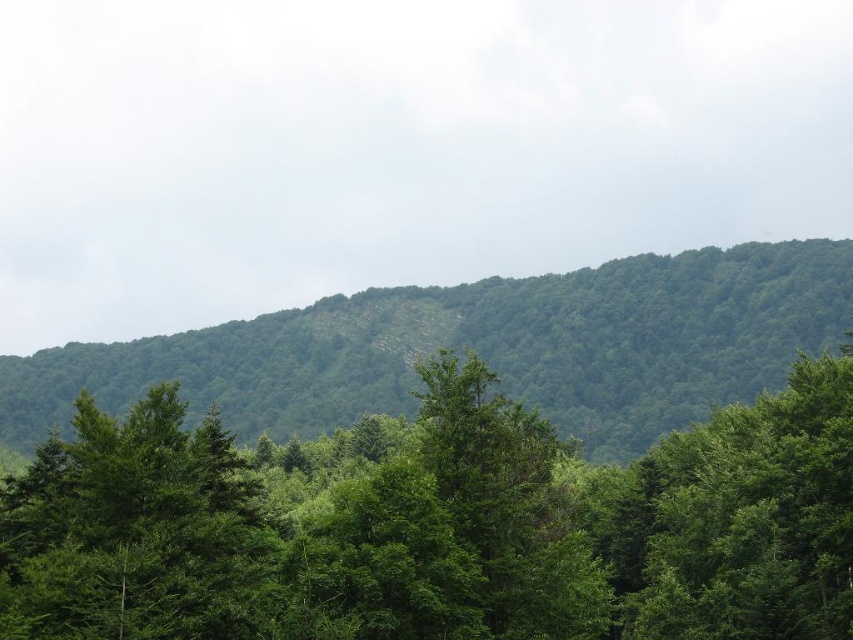
Between green leafy tree at center and green leafy forest at upper center, which one is positioned higher?

green leafy forest at upper center

Does point (474, 493) come behind point (572, 356)?

No, (474, 493) is in front of (572, 356).

Which is behind, point (386, 588) or point (312, 413)?

The point (312, 413) is behind.

Identify the location of green leafy tree at center. (437, 524).